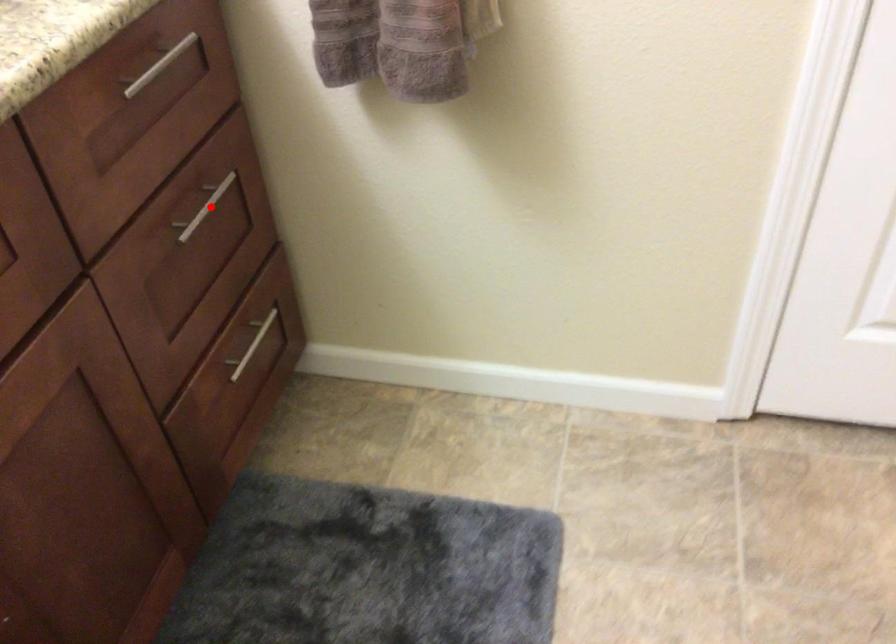
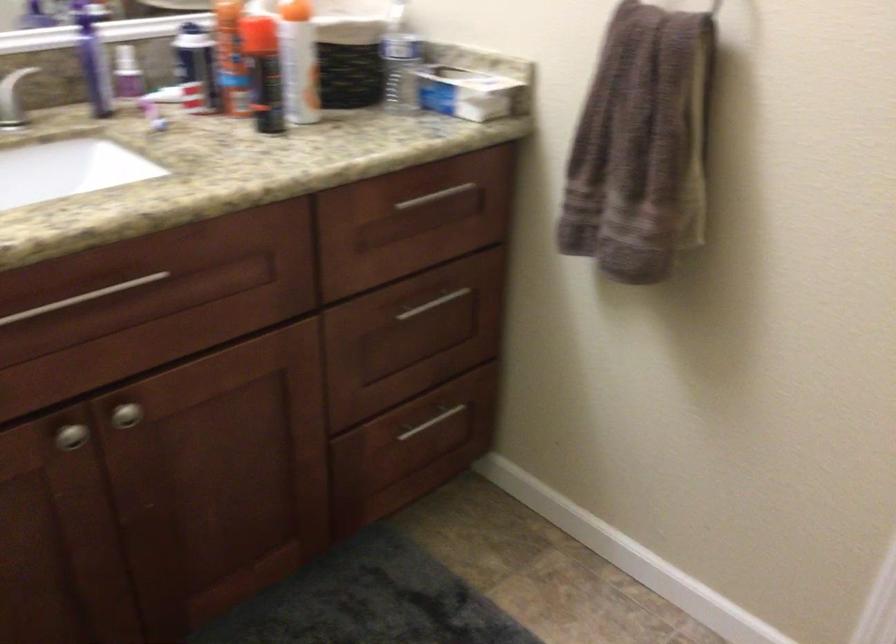
Question: A red point is marked in image1. In image2, is the corresponding 3D point closer to the camera or farther? Reply with the corresponding letter.

Choices:
 (A) The corresponding 3D point is closer.
 (B) The corresponding 3D point is farther.

Answer: (B)